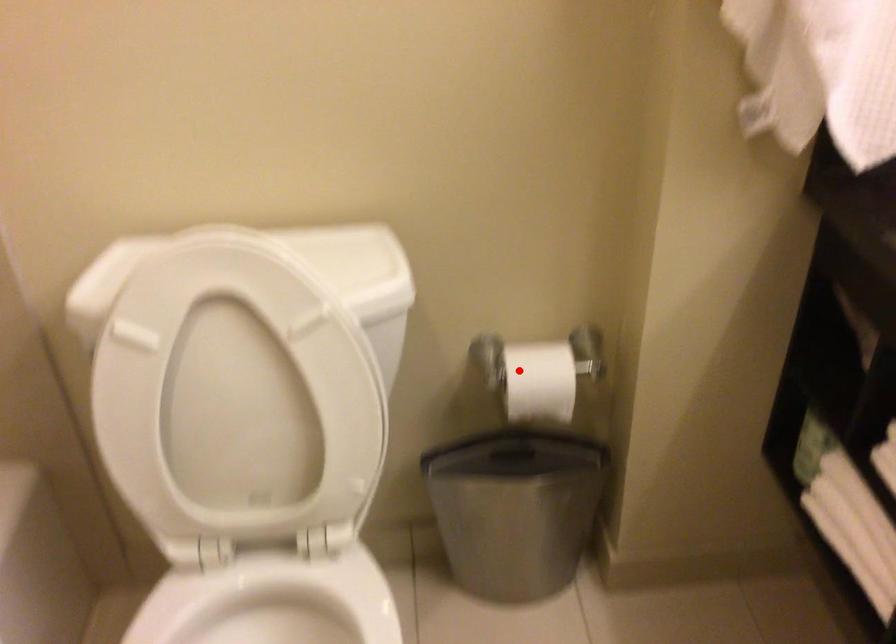
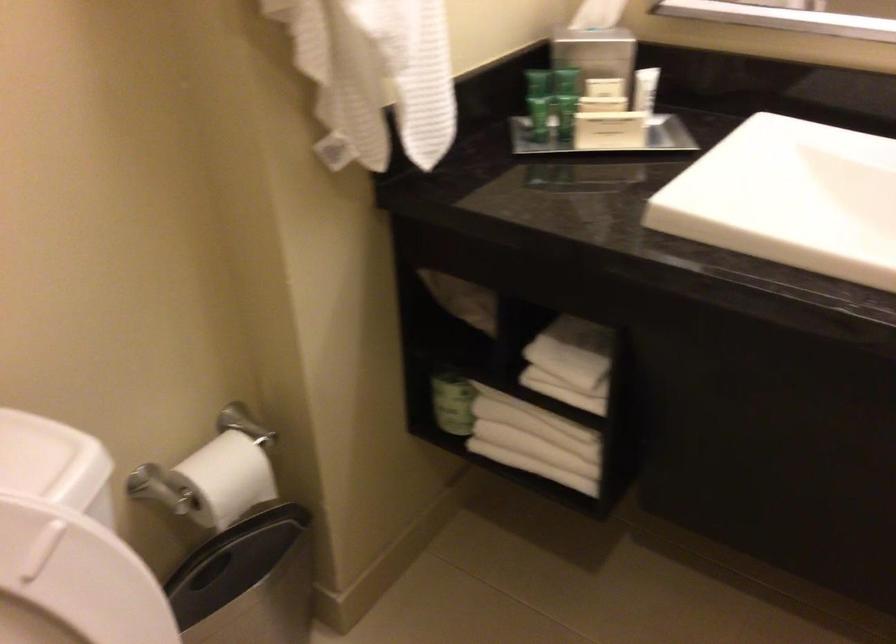
The point at the highlighted location is marked in the first image. Where is the corresponding point in the second image?

(211, 480)